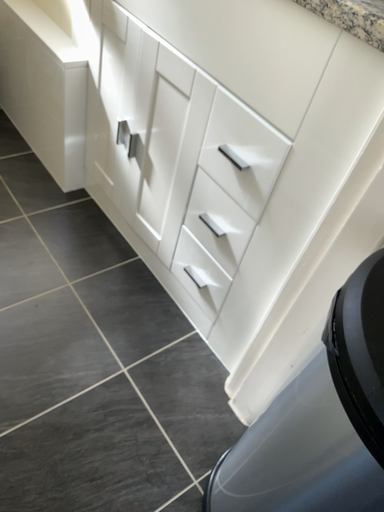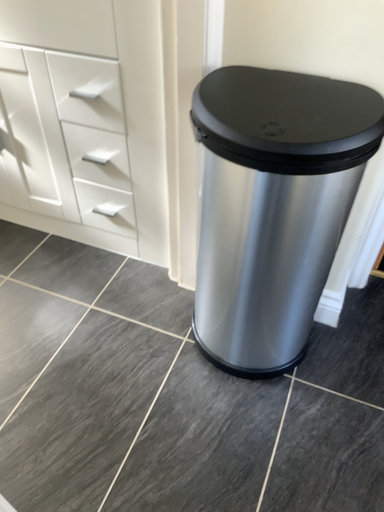
Question: How did the camera likely rotate when shooting the video?

Choices:
 (A) rotated left
 (B) rotated right

Answer: (B)